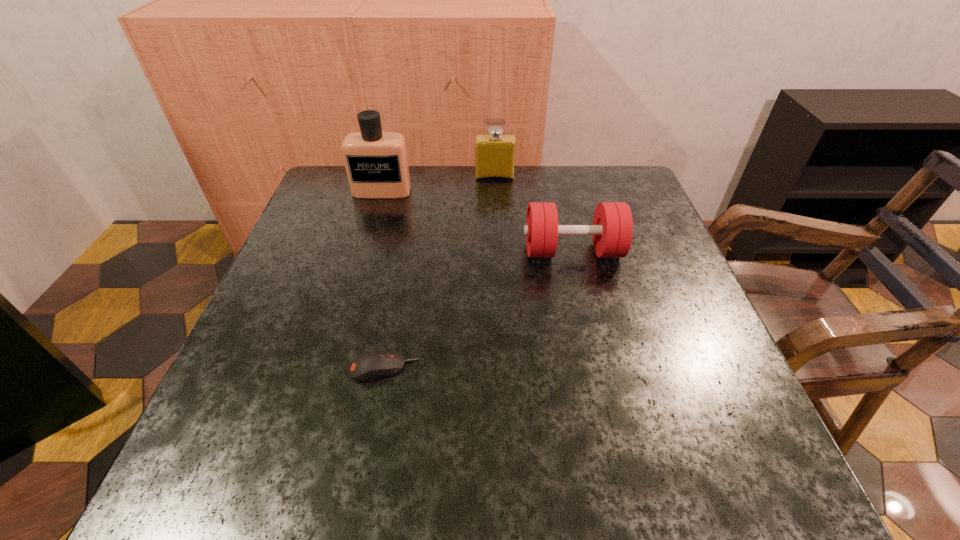
You are a GUI agent. You are given a task and a screenshot of the screen. Output one action in this format:
    pyautogui.click(x=<x>, y=<y>)
    Task: Click on the taller perfume
    This screenshot has height=540, width=960.
    Given the screenshot: What is the action you would take?
    [376, 163]

Find the location of a particular element. This screenshot has height=540, width=960. the nearer perfume is located at coordinates (376, 163).

Locate an element on the screen. the right perfume is located at coordinates pos(495,152).

Locate an element on the screen. The image size is (960, 540). the third object from left to right is located at coordinates (495, 152).

What are the coordinates of `the third tallest object` in the screenshot? It's located at (612, 229).

At what (x,y) coordinates should I click in order to perform the action: click on dumbbell. Please return your answer as a coordinate pair (x, y). This screenshot has width=960, height=540. Looking at the image, I should click on (612, 229).

Identify the location of the nearest object. (373, 364).

At what (x,y) coordinates should I click in order to perform the action: click on computer mouse. Please return your answer as a coordinate pair (x, y). Image resolution: width=960 pixels, height=540 pixels. Looking at the image, I should click on (373, 364).

This screenshot has width=960, height=540. Find the location of `free space located on the front label of the tallest object`. free space located on the front label of the tallest object is located at coordinates (347, 313).

I want to click on vacant space positioned on the front-facing side of the farthest object, so [497, 242].